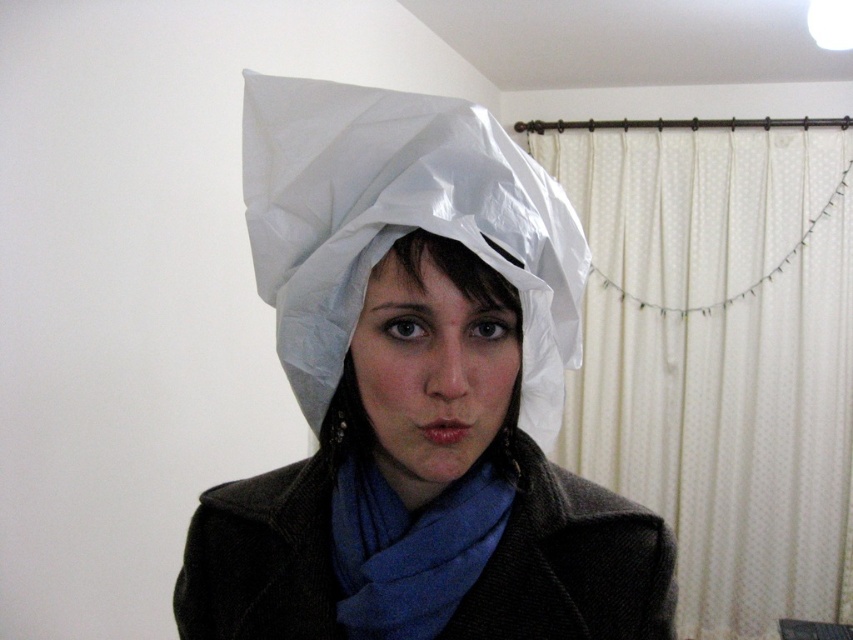
Does point (474, 214) come closer to viewer compared to point (347, 506)?

That is True.

How distant is white glossy paper hat at center from blue soft scarf at center?

The distance of white glossy paper hat at center from blue soft scarf at center is 3.14 inches.

Does point (482, 308) come farther from viewer compared to point (349, 470)?

No.

Locate an element on the screen. This screenshot has width=853, height=640. white glossy paper hat at center is located at coordinates (415, 394).

Does matte white paper hat at center come behind blue soft scarf at center?

No.

Who is positioned more to the left, matte white paper hat at center or blue soft scarf at center?

From the viewer's perspective, blue soft scarf at center appears more on the left side.

Identify the location of matte white paper hat at center. This screenshot has width=853, height=640. (430, 364).

Does white glossy paper hat at center have a lesser width compared to white plastic bag at center?

No.

Does white glossy paper hat at center have a smaller size compared to white plastic bag at center?

Incorrect, white glossy paper hat at center is not smaller in size than white plastic bag at center.

The width and height of the screenshot is (853, 640). Describe the element at coordinates (415, 394) in the screenshot. I see `white glossy paper hat at center` at that location.

At what (x,y) coordinates should I click in order to perform the action: click on white glossy paper hat at center. Please return your answer as a coordinate pair (x, y). This screenshot has width=853, height=640. Looking at the image, I should click on (415, 394).